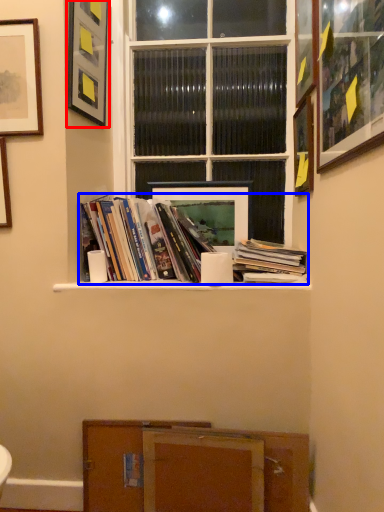
Question: Which point is further to the camera, picture frame (highlighted by a red box) or book (highlighted by a blue box)?

Choices:
 (A) picture frame
 (B) book

Answer: (B)